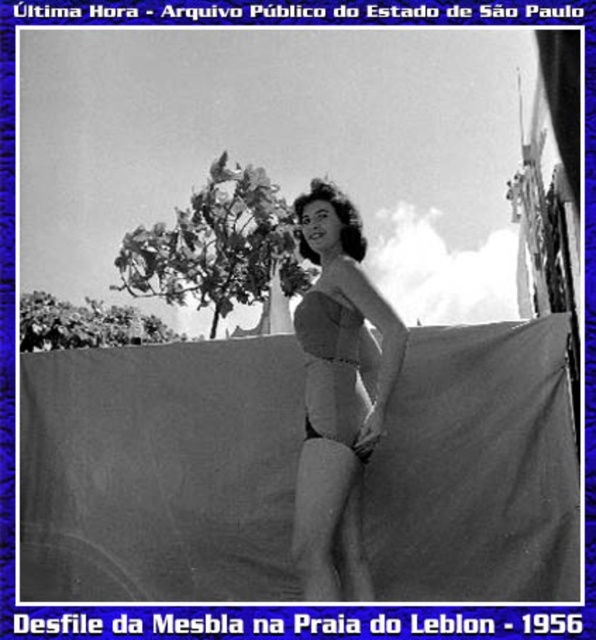
You are a fashion designer observing the Mesbla Parade at Leblon Beach in 1956. You notice the gray fabric at center and the matte fabric bikini top at center in the photograph. How far apart are these two items in centimeters?

The gray fabric at center and the matte fabric bikini top at center are 69.42 centimeters apart.

You are a photographer analyzing the composition of this black and white photo from 1956. You notice the gray fabric at center. Can you determine its exact 2D coordinates in the image?

The gray fabric at center is located at the 2D coordinates point (159, 472).